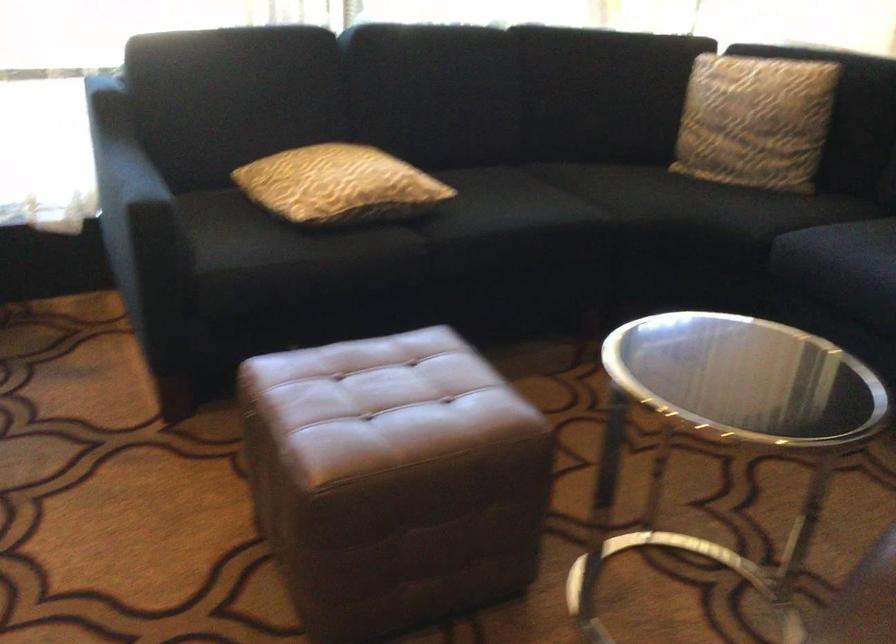
Where is `sofa sitting surface`? This screenshot has width=896, height=644. sofa sitting surface is located at coordinates (624, 180).